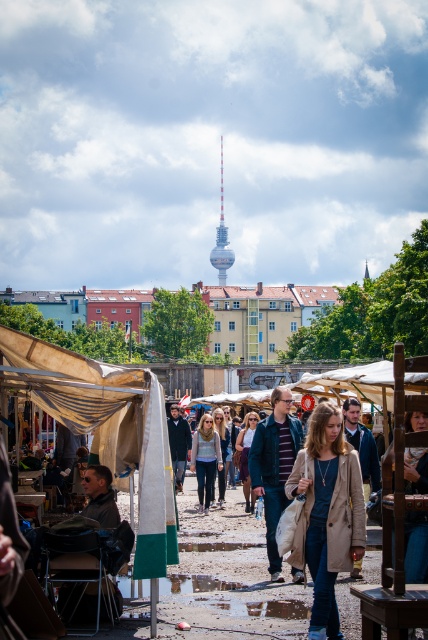
Question: Considering the relative positions of beige canvas tent at center and beige fabric canopy at lower left in the image provided, where is beige canvas tent at center located with respect to beige fabric canopy at lower left?

Choices:
 (A) left
 (B) right

Answer: (B)

Question: Which of these objects is positioned farthest from the blue denim jacket at center?

Choices:
 (A) light beige coat at center
 (B) beige fabric canopy at lower left

Answer: (B)

Question: Which of the following is the farthest from the observer?

Choices:
 (A) (196, 451)
 (B) (50, 342)
 (C) (222, 205)
 (D) (333, 468)

Answer: (C)

Question: Is beige fabric canopy at lower left below blue denim jacket at center?

Choices:
 (A) no
 (B) yes

Answer: (A)

Question: Is matte gray sweater at center thinner than silver metallic tower at center?

Choices:
 (A) no
 (B) yes

Answer: (B)

Question: Which of these objects is positioned farthest from the beige canvas tent at center?

Choices:
 (A) matte gray sweater at center
 (B) silver metallic tower at center
 (C) blue denim jacket at center
 (D) light beige coat at center

Answer: (B)